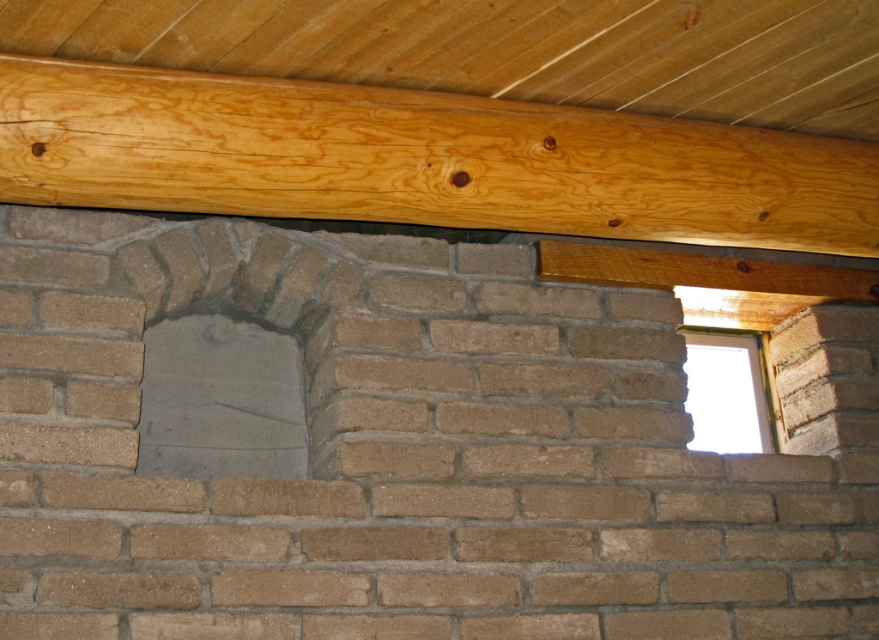
You are an architect designing a renovation for this brick wall. You need to install a new support beam that must be placed behind the existing structures. Given the natural wood beam at upper center and the gray concrete hole at center, which object should the new beam be placed behind?

The new support beam should be placed behind the gray concrete hole at center because the natural wood beam at upper center is already in front of it, so placing the new beam behind the gray concrete hole at center would maintain the structural integrity and alignment.

You are an architect designing a new structure and want to ensure that the natural wood beam at upper center does not block the gray concrete hole at center. Based on the scene description, is the beam currently positioned in a way that could obstruct the hole?

The natural wood beam at upper center is positioned over the gray concrete hole at center, so it is currently obstructing the hole and may block access or visibility.

You are standing in front of a brick wall with a wooden beam above it. There is a recessed area on the left and a window on the right. A gray concrete hole is located at point (220, 401). If you were to throw a small ball straight ahead, would it hit the wooden beam, the recessed area, the window, or the gray concrete hole?

The gray concrete hole at center is located at point (220, 401), so the ball would go through the gray concrete hole at center.